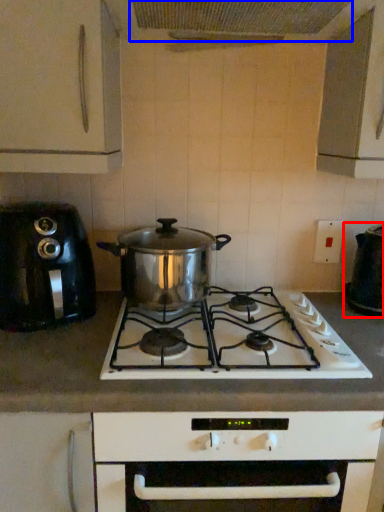
Question: Which of the following is the farthest to the observer, kitchen appliance (highlighted by a red box) or exhaust hood (highlighted by a blue box)?

Choices:
 (A) kitchen appliance
 (B) exhaust hood

Answer: (A)